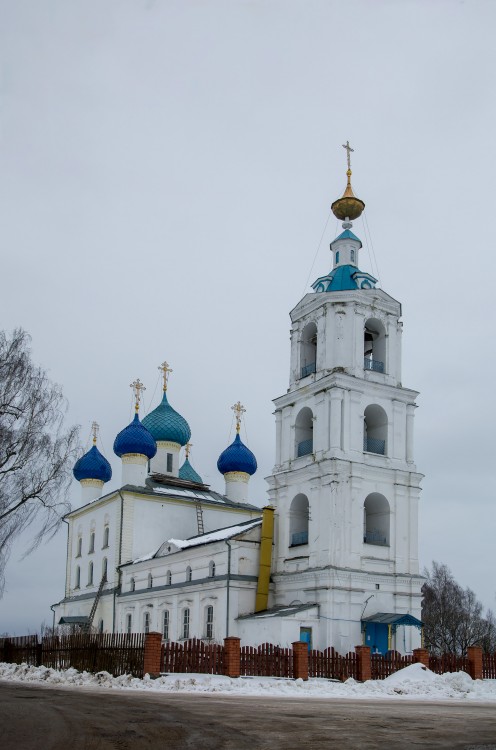
Identify the location of window. The image size is (496, 750). (185, 628).